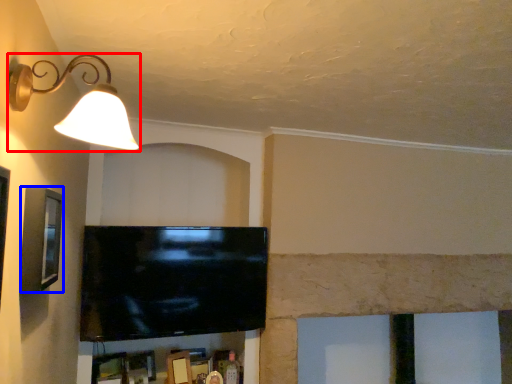
Question: Which of the following is the closest to the observer, lamp (highlighted by a red box) or picture frame (highlighted by a blue box)?

Choices:
 (A) lamp
 (B) picture frame

Answer: (A)